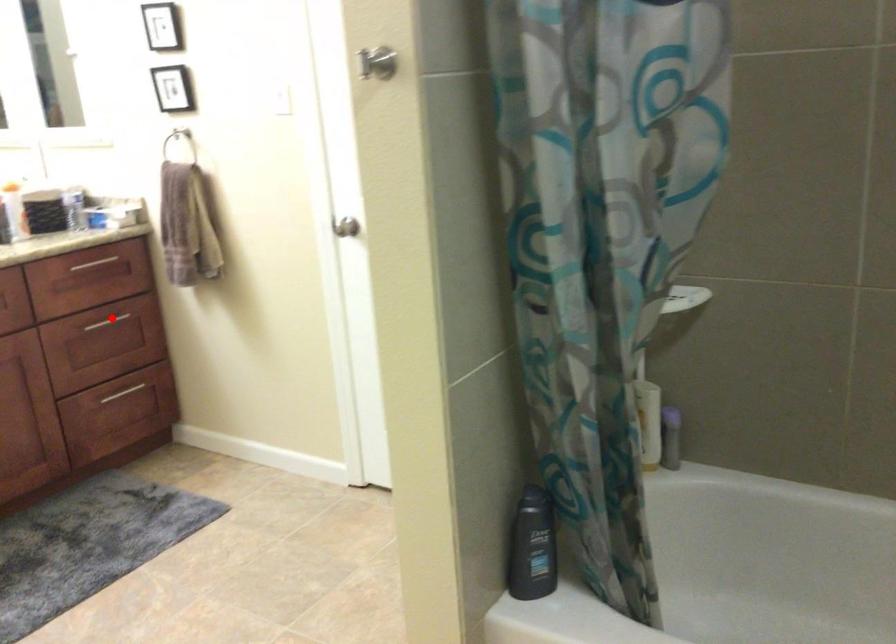
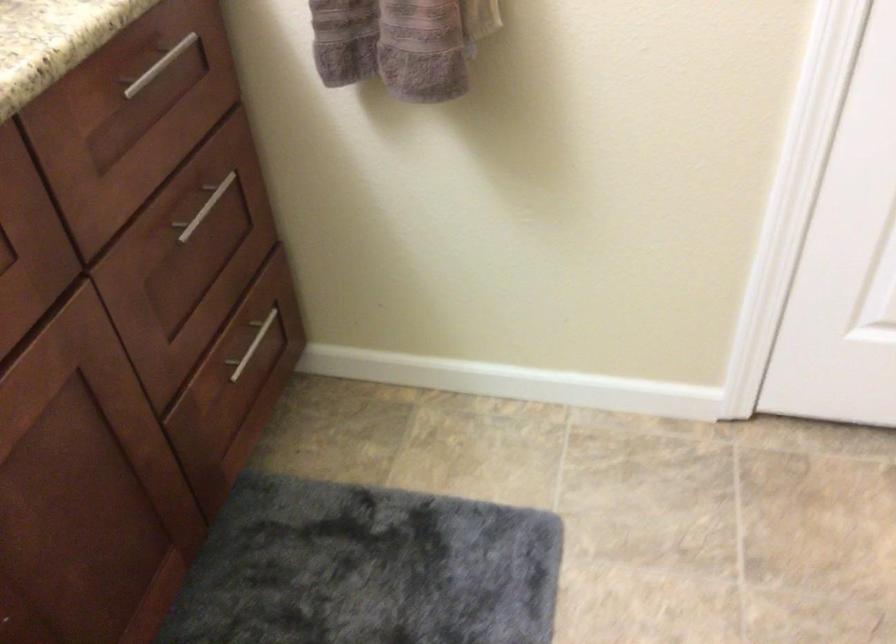
Where in the second image is the point corresponding to the highlighted location from the first image?

(203, 207)